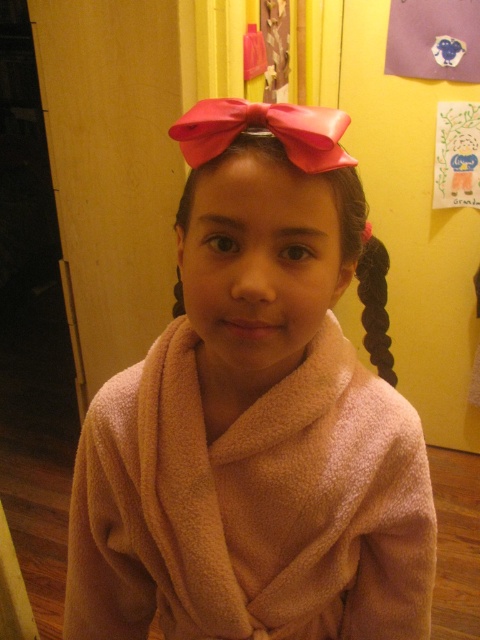
You are standing in a room and see two points marked on the wall. The first point is at coordinate point (x=254, y=108) and the second is at point (x=375, y=262). Which point is closer to you?

Point (x=254, y=108) is closer to the viewer than point (x=375, y=262).

Consider the image. The young girl in the image has two accessories. One is the pink satin bow at upper center and the other is the black silky hair at right. Which accessory is smaller in size?

The pink satin bow at upper center is smaller in size compared to the black silky hair at right.

You are standing in a room and see two points marked on the wall. The first point is at position point (287, 604) and the second point is at position point (188, 225). If you want to touch both points starting from the nearest one, which point should you reach for first?

Point point (188, 225) is closer to you than point point (287, 604), so you should reach for point point (188, 225) first.